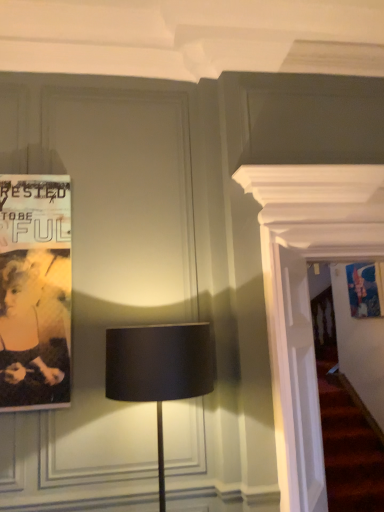
This screenshot has width=384, height=512. What do you see at coordinates (159, 370) in the screenshot?
I see `matte black lamp at center` at bounding box center [159, 370].

In order to face matte black lamp at center, should I rotate leftwards or rightwards?

Rotate left and turn 4.291 degrees.

Image resolution: width=384 pixels, height=512 pixels. I want to click on matte black lamp at center, so click(x=159, y=370).

The height and width of the screenshot is (512, 384). I want to click on black paper poster at left, so pyautogui.click(x=35, y=291).

The height and width of the screenshot is (512, 384). Describe the element at coordinates (35, 291) in the screenshot. I see `black paper poster at left` at that location.

In order to face black paper poster at left, should I rotate leftwards or rightwards?

Turn left by 20.652 degrees to look at black paper poster at left.

Image resolution: width=384 pixels, height=512 pixels. What are the coordinates of `matte black lamp at center` in the screenshot? It's located at (159, 370).

Is matte black lamp at center at the left side of black paper poster at left?

No, matte black lamp at center is not to the left of black paper poster at left.

Is matte black lamp at center closer to camera compared to black paper poster at left?

Yes, matte black lamp at center is in front of black paper poster at left.

Does point (109, 365) come in front of point (37, 392)?

That is True.

From the image's perspective, is matte black lamp at center located above or below black paper poster at left?

matte black lamp at center is below black paper poster at left.

From a real-world perspective, which is physically below, matte black lamp at center or black paper poster at left?

matte black lamp at center is physically lower.

Is matte black lamp at center thinner than black paper poster at left?

In fact, matte black lamp at center might be wider than black paper poster at left.

Is matte black lamp at center shorter than black paper poster at left?

Correct, matte black lamp at center is not as tall as black paper poster at left.

Can you confirm if matte black lamp at center is smaller than black paper poster at left?

Actually, matte black lamp at center might be larger than black paper poster at left.

Is matte black lamp at center not within black paper poster at left?

Indeed, matte black lamp at center is completely outside black paper poster at left.

Is the surface of matte black lamp at center in direct contact with black paper poster at left?

No, matte black lamp at center is not beside black paper poster at left.

Is matte black lamp at center facing towards black paper poster at left?

No, matte black lamp at center is not facing towards black paper poster at left.

Can you tell me how much matte black lamp at center and black paper poster at left differ in facing direction?

matte black lamp at center and black paper poster at left are facing 0.287 degrees away from each other.

How far apart are matte black lamp at center and black paper poster at left?

27.59 inches.

Image resolution: width=384 pixels, height=512 pixels. What are the coordinates of `poster positioned vertically above the matte black lamp at center (from a real-world perspective)` in the screenshot? It's located at (35, 291).

Between black paper poster at left and matte black lamp at center, which one appears on the left side from the viewer's perspective?

black paper poster at left is more to the left.

Is the depth of black paper poster at left less than that of matte black lamp at center?

No, black paper poster at left is behind matte black lamp at center.

Is point (56, 350) closer or farther from the camera than point (159, 388)?

Point (56, 350) appears to be farther away from the viewer than point (159, 388).

From the image's perspective, which one is positioned higher, black paper poster at left or matte black lamp at center?

black paper poster at left, from the image's perspective.

Based on the photo, from a real-world perspective, who is located higher, black paper poster at left or matte black lamp at center?

black paper poster at left is physically above.

Which of these two, black paper poster at left or matte black lamp at center, is thinner?

Thinner between the two is black paper poster at left.

Is black paper poster at left taller or shorter than matte black lamp at center?

Clearly, black paper poster at left is taller compared to matte black lamp at center.

Is black paper poster at left bigger than matte black lamp at center?

No, black paper poster at left is not bigger than matte black lamp at center.

From the picture: Is black paper poster at left outside of matte black lamp at center?

Yes, black paper poster at left is located beyond the bounds of matte black lamp at center.

Is black paper poster at left touching matte black lamp at center?

No, black paper poster at left is not touching matte black lamp at center.

Is black paper poster at left facing towards matte black lamp at center?

No, black paper poster at left does not turn towards matte black lamp at center.

Where is `lamp below the black paper poster at left (from the image's perspective)`? Image resolution: width=384 pixels, height=512 pixels. lamp below the black paper poster at left (from the image's perspective) is located at coordinates (159, 370).

Where is `lamp that is under the black paper poster at left (from a real-world perspective)`? This screenshot has height=512, width=384. lamp that is under the black paper poster at left (from a real-world perspective) is located at coordinates (159, 370).

The width and height of the screenshot is (384, 512). I want to click on poster on the left of matte black lamp at center, so click(x=35, y=291).